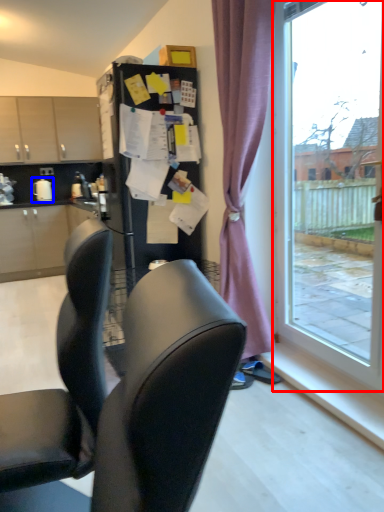
Question: Which object appears farthest to the camera in this image, window (highlighted by a red box) or appliance (highlighted by a blue box)?

Choices:
 (A) window
 (B) appliance

Answer: (B)